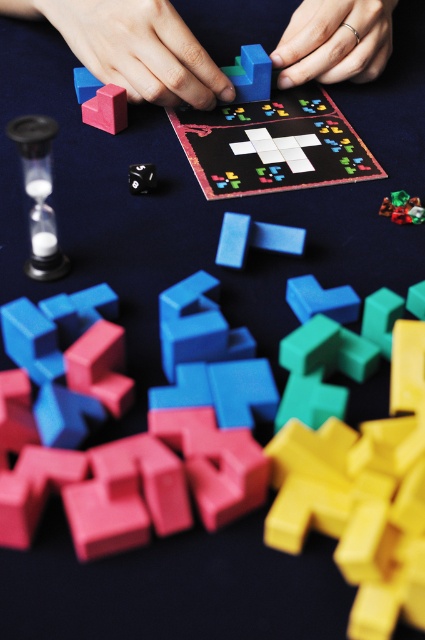
How distant is rubberized matte blue tetromino at upper center from silver metallic ring at upper center?

The distance of rubberized matte blue tetromino at upper center from silver metallic ring at upper center is 2.95 inches.

Locate an element on the screen. Image resolution: width=425 pixels, height=640 pixels. rubberized matte blue tetromino at upper center is located at coordinates (133, 48).

Does point (331, 58) come behind point (354, 36)?

Yes, it is behind point (354, 36).

Where is `rubberized matte blue tetromino at upper center`? This screenshot has height=640, width=425. rubberized matte blue tetromino at upper center is located at coordinates (133, 48).

Based on the photo, does silver metallic ring at upper center have a lesser width compared to rubberized matte cube at upper left?

No, silver metallic ring at upper center is not thinner than rubberized matte cube at upper left.

Identify the location of silver metallic ring at upper center. The width and height of the screenshot is (425, 640). coord(334,42).

Does point (370, 19) come farther from viewer compared to point (102, 112)?

Yes, point (370, 19) is behind point (102, 112).

The image size is (425, 640). In order to click on silver metallic ring at upper center in this screenshot , I will do `click(334, 42)`.

Is rubberized matte blue tetromino at upper center to the left of translucent glass hourglass at left from the viewer's perspective?

Incorrect, rubberized matte blue tetromino at upper center is not on the left side of translucent glass hourglass at left.

Between rubberized matte blue tetromino at upper center and translucent glass hourglass at left, which one appears on the left side from the viewer's perspective?

From the viewer's perspective, translucent glass hourglass at left appears more on the left side.

Who is more distant from viewer, [90,22] or [39,179]?

Point [90,22]

Image resolution: width=425 pixels, height=640 pixels. I want to click on rubberized matte blue tetromino at upper center, so click(x=133, y=48).